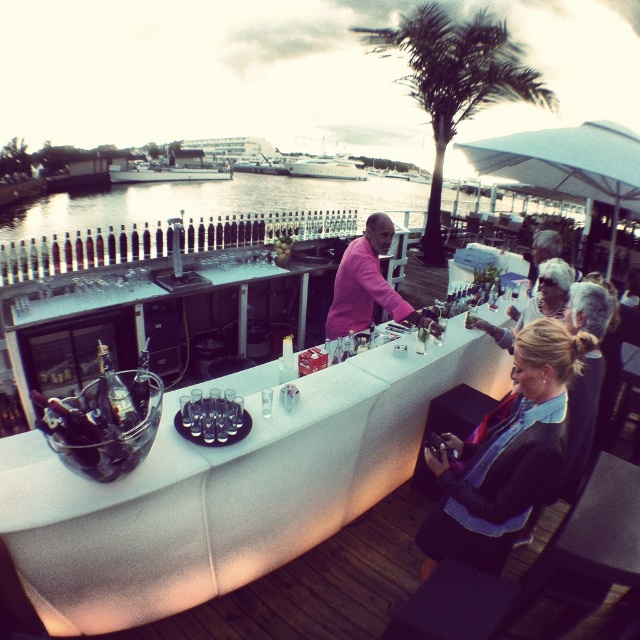
Question: Estimate the real-world distances between objects in this image. Which object is farther from the green leafy palm tree at center?

Choices:
 (A) denim jacket at lower right
 (B) white textured bar at center

Answer: (A)

Question: Which object is positioned farthest from the green leafy palm tree at center?

Choices:
 (A) white textured bar at center
 (B) denim jacket at lower right

Answer: (B)

Question: Is white textured bar at center closer to the viewer compared to green leafy palm tree at center?

Choices:
 (A) no
 (B) yes

Answer: (B)

Question: Which of the following is the closest to the observer?

Choices:
 (A) white textured bar at center
 (B) green leafy palm tree at center
 (C) denim jacket at lower right

Answer: (C)

Question: Can you confirm if white textured bar at center is smaller than denim jacket at lower right?

Choices:
 (A) yes
 (B) no

Answer: (B)

Question: Can you confirm if white textured bar at center is thinner than denim jacket at lower right?

Choices:
 (A) yes
 (B) no

Answer: (B)